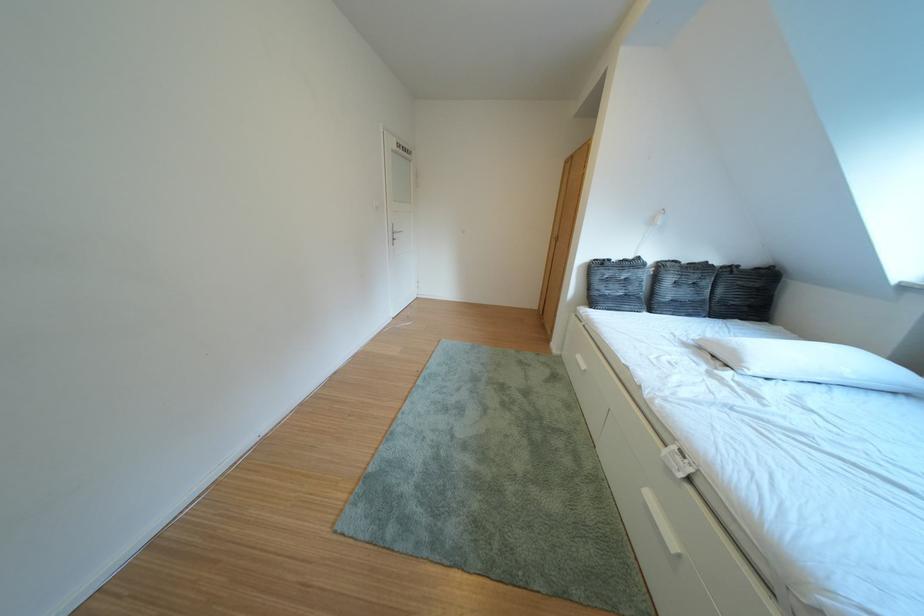
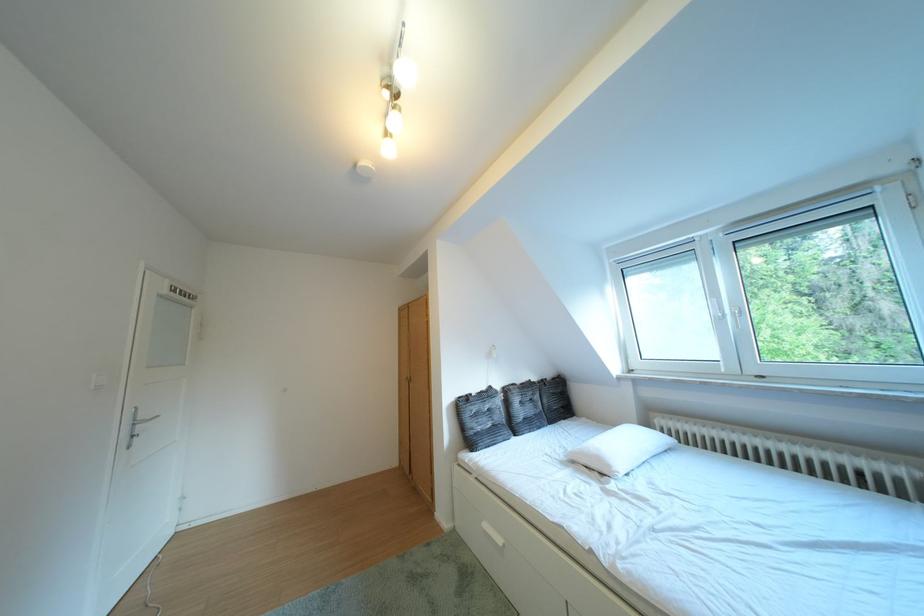
Locate, in the second image, the point that corresponds to [405,231] in the first image.

(141, 418)